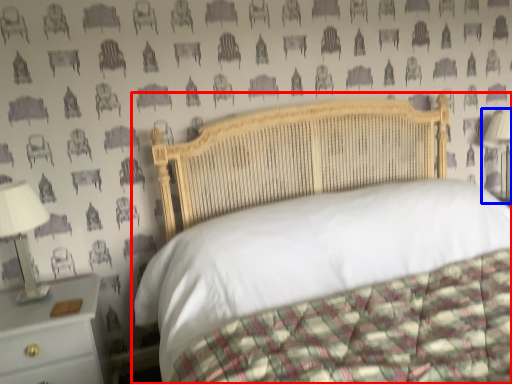
Question: Which object is further to the camera taking this photo, bed (highlighted by a red box) or bedside lamp (highlighted by a blue box)?

Choices:
 (A) bed
 (B) bedside lamp

Answer: (B)